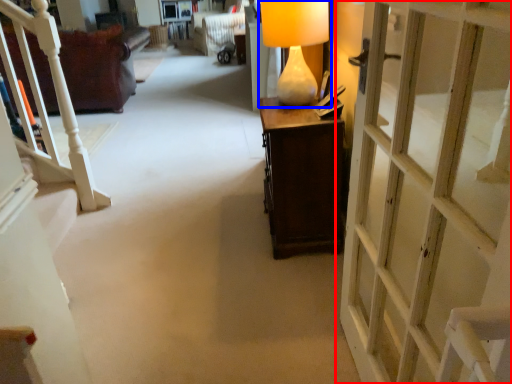
Question: Which point is closer to the camera, door (highlighted by a red box) or table lamp (highlighted by a blue box)?

Choices:
 (A) door
 (B) table lamp

Answer: (A)